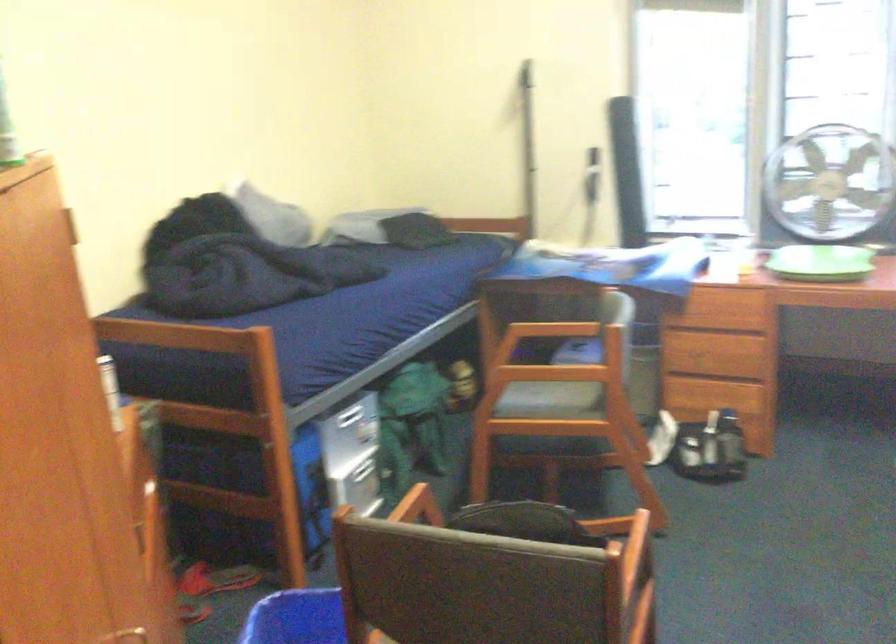
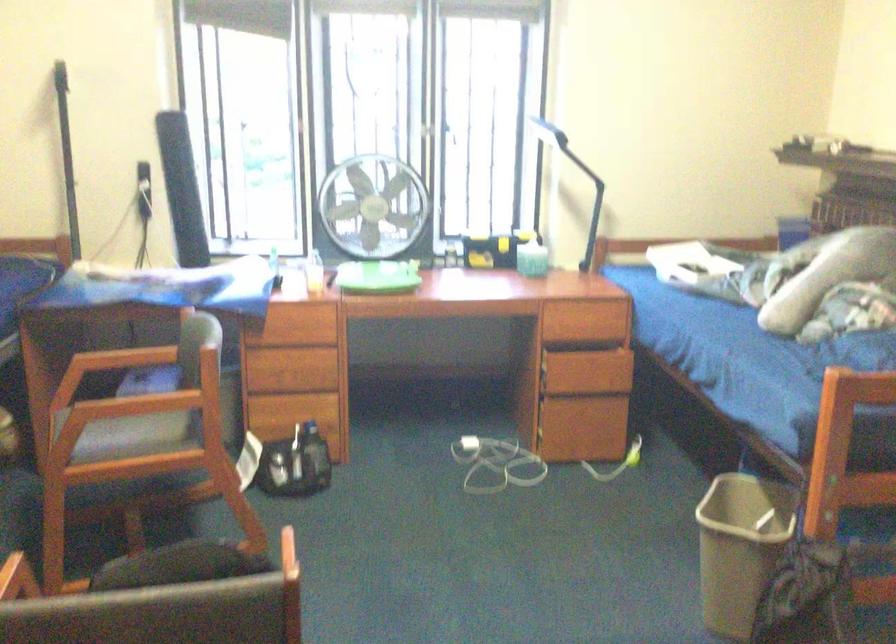
Question: The camera is either moving clockwise (left) or counter-clockwise (right) around the object. The first image is from the beginning of the video and the second image is from the end. Is the camera moving left or right when shooting the video?

Choices:
 (A) Left
 (B) Right

Answer: (A)